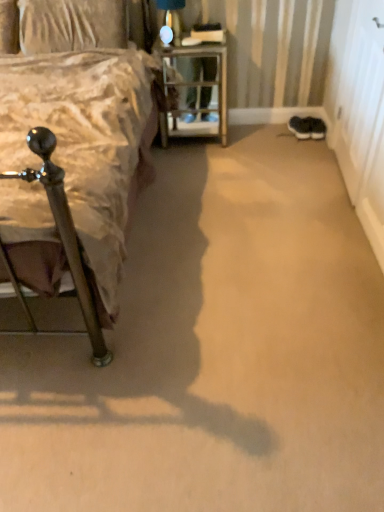
What do you see at coordinates (315, 127) in the screenshot? This screenshot has height=512, width=384. I see `black suede sneakers at lower right, which is the 2th footwear from left to right` at bounding box center [315, 127].

The height and width of the screenshot is (512, 384). In order to click on textured beige pillow at upper left in this screenshot , I will do `click(71, 25)`.

What do you see at coordinates (359, 110) in the screenshot?
I see `white wood screen door at right` at bounding box center [359, 110].

Describe the element at coordinates (72, 174) in the screenshot. I see `metallic silver bed at left` at that location.

The image size is (384, 512). In order to click on black suede sneakers at lower right, which is the 2th footwear from left to right in this screenshot , I will do `click(315, 127)`.

The height and width of the screenshot is (512, 384). What are the coordinates of `bed above the white wood screen door at right (from a real-world perspective)` in the screenshot? It's located at (72, 174).

Is white wood screen door at right facing towards metallic silver bed at left?

Yes, white wood screen door at right is aimed at metallic silver bed at left.

Is white wood screen door at right to the left of metallic silver bed at left from the viewer's perspective?

No, white wood screen door at right is not to the left of metallic silver bed at left.

Is white wood screen door at right positioned far away from metallic silver bed at left?

Absolutely, white wood screen door at right is distant from metallic silver bed at left.

Is textured beige pillow at upper left at the back of black suede sneakers at lower right, which is the second footwear in right-to-left order?

That's not correct — black suede sneakers at lower right, which is the second footwear in right-to-left order, is not looking away from textured beige pillow at upper left.

Consider the image. Does black suede sneakers at lower right, the 1th footwear viewed from the left, appear on the right side of textured beige pillow at upper left?

Indeed, black suede sneakers at lower right, the 1th footwear viewed from the left, is positioned on the right side of textured beige pillow at upper left.

From a real-world perspective, between black suede sneakers at lower right, which is the second footwear in right-to-left order, and textured beige pillow at upper left, who is vertically higher?

textured beige pillow at upper left, from a real-world perspective.

The height and width of the screenshot is (512, 384). Identify the location of the 1st footwear below the textured beige pillow at upper left (from a real-world perspective). (300, 127).

Which object is closer to the camera taking this photo, white wood screen door at right or black suede sneakers at lower right, which is the 2th footwear from left to right?

white wood screen door at right is in front.

Considering the relative sizes of white wood screen door at right and black suede sneakers at lower right, which is the 2th footwear from left to right, in the image provided, is white wood screen door at right taller than black suede sneakers at lower right, which is the 2th footwear from left to right,?

Yes, white wood screen door at right is taller than black suede sneakers at lower right, which is the 2th footwear from left to right.

Can black suede sneakers at lower right, which is the 2th footwear from left to right, be found inside white wood screen door at right?

No, black suede sneakers at lower right, which is the 2th footwear from left to right, is not surrounded by white wood screen door at right.

From the image's perspective, who appears lower, white wood screen door at right or black suede sneakers at lower right, which is the 2th footwear from left to right?

From the image's view, white wood screen door at right is below.

Is black suede sneakers at lower right, which is the second footwear in right-to-left order, facing towards black suede sneakers at lower right, marked as the first footwear in a right-to-left arrangement?

No.

Is black suede sneakers at lower right, which is the second footwear in right-to-left order, taller or shorter than black suede sneakers at lower right, marked as the first footwear in a right-to-left arrangement?

Considering their sizes, black suede sneakers at lower right, which is the second footwear in right-to-left order, has less height than black suede sneakers at lower right, marked as the first footwear in a right-to-left arrangement.

Does black suede sneakers at lower right, the 1th footwear viewed from the left, touch black suede sneakers at lower right, marked as the first footwear in a right-to-left arrangement?

Yes, black suede sneakers at lower right, the 1th footwear viewed from the left, is in contact with black suede sneakers at lower right, marked as the first footwear in a right-to-left arrangement.

Which is in front, point (306, 119) or point (4, 152)?

The point (4, 152) is closer to the camera.

Does black suede sneakers at lower right, marked as the first footwear in a right-to-left arrangement, turn towards metallic silver bed at left?

No, black suede sneakers at lower right, marked as the first footwear in a right-to-left arrangement, does not turn towards metallic silver bed at left.

Choose the correct answer: Is black suede sneakers at lower right, marked as the first footwear in a right-to-left arrangement, inside metallic silver bed at left or outside it?

black suede sneakers at lower right, marked as the first footwear in a right-to-left arrangement, is not enclosed by metallic silver bed at left.

Is black suede sneakers at lower right, marked as the first footwear in a right-to-left arrangement, smaller than metallic silver bed at left?

Yes.

What are the coordinates of `footwear on the left of the black suede sneakers at lower right, which is the 2th footwear from left to right` in the screenshot? It's located at (300, 127).

Is black suede sneakers at lower right, which is the 2th footwear from left to right, far away from black suede sneakers at lower right, the 1th footwear viewed from the left?

black suede sneakers at lower right, which is the 2th footwear from left to right, is near black suede sneakers at lower right, the 1th footwear viewed from the left, not far away.

Is black suede sneakers at lower right, which is the 2th footwear from left to right, bigger than black suede sneakers at lower right, the 1th footwear viewed from the left?

No, black suede sneakers at lower right, which is the 2th footwear from left to right, is not bigger than black suede sneakers at lower right, the 1th footwear viewed from the left.

From a real-world perspective, is black suede sneakers at lower right, marked as the first footwear in a right-to-left arrangement, physically located above or below black suede sneakers at lower right, which is the second footwear in right-to-left order?

black suede sneakers at lower right, marked as the first footwear in a right-to-left arrangement, is situated lower than black suede sneakers at lower right, which is the second footwear in right-to-left order, in the real world.

How distant is metal/textured nightstand at center from white wood screen door at right?

metal/textured nightstand at center is 92.00 centimeters away from white wood screen door at right.

Is metal/textured nightstand at center aimed at white wood screen door at right?

No.

Would you say metal/textured nightstand at center is a long distance from white wood screen door at right?

metal/textured nightstand at center is actually quite close to white wood screen door at right.

Identify the location of bed that appears below the white wood screen door at right (from the image's perspective). This screenshot has width=384, height=512. (72, 174).

Where is `pillow above the black suede sneakers at lower right, the 1th footwear viewed from the left (from the image's perspective)`? This screenshot has width=384, height=512. pillow above the black suede sneakers at lower right, the 1th footwear viewed from the left (from the image's perspective) is located at coordinates (71, 25).

When comparing their distances from white wood screen door at right, does textured beige pillow at upper left or metal/textured nightstand at center seem closer?

metal/textured nightstand at center is positioned closer to the anchor white wood screen door at right.

Based on their spatial positions, is black suede sneakers at lower right, which is the 2th footwear from left to right, or black suede sneakers at lower right, which is the second footwear in right-to-left order, closer to metal/textured nightstand at center?

black suede sneakers at lower right, which is the second footwear in right-to-left order, lies closer to metal/textured nightstand at center than the other object.

Which object lies further to the anchor point black suede sneakers at lower right, marked as the first footwear in a right-to-left arrangement, textured beige pillow at upper left or white wood screen door at right?

textured beige pillow at upper left is positioned further to the anchor black suede sneakers at lower right, marked as the first footwear in a right-to-left arrangement.

From the image, which object appears to be nearer to textured beige pillow at upper left, metallic silver bed at left or black suede sneakers at lower right, the 1th footwear viewed from the left?

metallic silver bed at left lies closer to textured beige pillow at upper left than the other object.

Looking at the image, which one is located further to metal/textured nightstand at center, black suede sneakers at lower right, the 1th footwear viewed from the left, or metallic silver bed at left?

metallic silver bed at left is positioned further to the anchor metal/textured nightstand at center.

Considering their positions, is textured beige pillow at upper left positioned further to white wood screen door at right than black suede sneakers at lower right, which is the second footwear in right-to-left order?

Based on the image, textured beige pillow at upper left appears to be further to white wood screen door at right.

Which object lies further to the anchor point black suede sneakers at lower right, marked as the first footwear in a right-to-left arrangement, textured beige pillow at upper left or metallic silver bed at left?

metallic silver bed at left lies further to black suede sneakers at lower right, marked as the first footwear in a right-to-left arrangement, than the other object.

When comparing their distances from white wood screen door at right, does black suede sneakers at lower right, marked as the first footwear in a right-to-left arrangement, or metallic silver bed at left seem further?

Among the two, metallic silver bed at left is located further to white wood screen door at right.

Identify the location of footwear between textured beige pillow at upper left and black suede sneakers at lower right, marked as the first footwear in a right-to-left arrangement, in the horizontal direction. (300, 127).

This screenshot has width=384, height=512. I want to click on nightstand between metallic silver bed at left and black suede sneakers at lower right, the 1th footwear viewed from the left, in the front-back direction, so click(196, 89).

The image size is (384, 512). What are the coordinates of `nightstand located between metallic silver bed at left and white wood screen door at right in the left-right direction` in the screenshot? It's located at (196, 89).

Locate an element on the screen. The width and height of the screenshot is (384, 512). nightstand located between textured beige pillow at upper left and black suede sneakers at lower right, which is the second footwear in right-to-left order, in the left-right direction is located at coordinates coord(196,89).